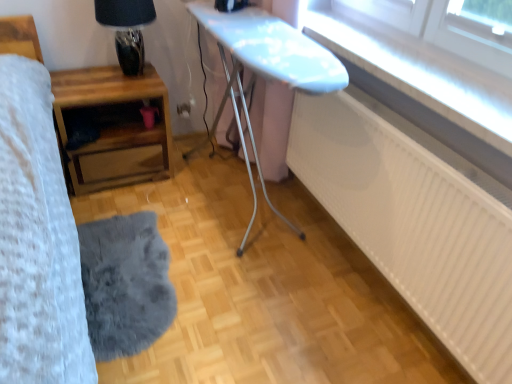
Identify the location of vacant region to the left of matte glass table lamp at upper left. (81, 79).